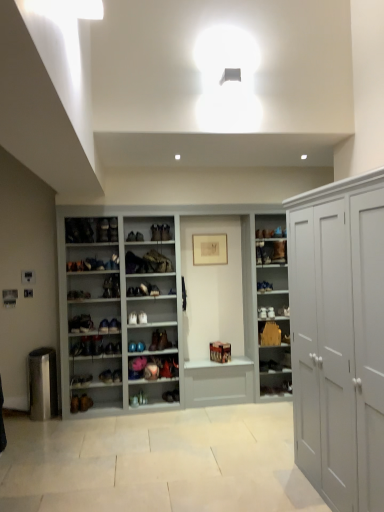
Question: Is matte white shoe at center, which appears as the fifth shoe when viewed from the top, taller than matte brown boot at center, acting as the third footwear starting from the left?

Choices:
 (A) no
 (B) yes

Answer: (B)

Question: Can matte brown boot at center, acting as the third footwear starting from the left, be found inside matte white shoe at center, which appears as the fifth shoe when viewed from the top?

Choices:
 (A) no
 (B) yes

Answer: (A)

Question: Is matte white shoe at center, the sixth shoe when ordered from bottom to top, oriented away from matte brown boot at center, placed as the first footwear when sorted from bottom to top?

Choices:
 (A) no
 (B) yes

Answer: (A)

Question: Does matte white shoe at center, the sixth shoe when ordered from bottom to top, touch matte brown boot at center, acting as the third footwear starting from the left?

Choices:
 (A) yes
 (B) no

Answer: (B)

Question: Does matte white shoe at center, which appears as the fifth shoe when viewed from the top, have a lesser width compared to matte brown boot at center, the third footwear from the top?

Choices:
 (A) yes
 (B) no

Answer: (B)

Question: From the image's perspective, relative to brown leather shoe at center, which appears as the third footwear when ordered from the bottom, is matte brown boot at center, arranged as the eighth shoe when ordered from the bottom, above or below?

Choices:
 (A) below
 (B) above

Answer: (A)

Question: Considering their positions, is matte brown boot at center, arranged as the eighth shoe when ordered from the bottom, located in front of or behind brown leather shoe at center, which appears as the 2th footwear when viewed from the right?

Choices:
 (A) behind
 (B) front

Answer: (B)

Question: Would you say matte brown boot at center, arranged as the eighth shoe when ordered from the bottom, is to the left or to the right of brown leather shoe at center, which appears as the third footwear when ordered from the bottom, in the picture?

Choices:
 (A) left
 (B) right

Answer: (A)

Question: From a real-world perspective, is matte brown boot at center, arranged as the eighth shoe when ordered from the bottom, physically located above or below brown leather shoe at center, which appears as the third footwear when ordered from the bottom?

Choices:
 (A) above
 (B) below

Answer: (B)

Question: Is white matte shoe rack at center bigger or smaller than matte brown boot at center, placed as the third shoe when sorted from top to bottom?

Choices:
 (A) big
 (B) small

Answer: (A)

Question: Is white matte shoe rack at center in front of or behind matte brown boot at center, arranged as the eighth shoe when ordered from the bottom, in the image?

Choices:
 (A) behind
 (B) front

Answer: (B)

Question: Is white matte shoe rack at center to the left or to the right of matte brown boot at center, arranged as the eighth shoe when ordered from the bottom, in the image?

Choices:
 (A) left
 (B) right

Answer: (B)

Question: From the image's perspective, is white matte shoe rack at center located above or below matte brown boot at center, placed as the third shoe when sorted from top to bottom?

Choices:
 (A) below
 (B) above

Answer: (B)

Question: In the image, is matte brown shoe at center, which is counted as the fourth shoe, starting from the bottom, positioned in front of or behind shiny brown leather shoe at center, which ranks as the third shoe in bottom-to-top order?

Choices:
 (A) front
 (B) behind

Answer: (B)

Question: From a real-world perspective, relative to shiny brown leather shoe at center, marked as the eighth shoe in a top-to-bottom arrangement, is matte brown shoe at center, which is counted as the fourth shoe, starting from the bottom, vertically above or below?

Choices:
 (A) above
 (B) below

Answer: (B)